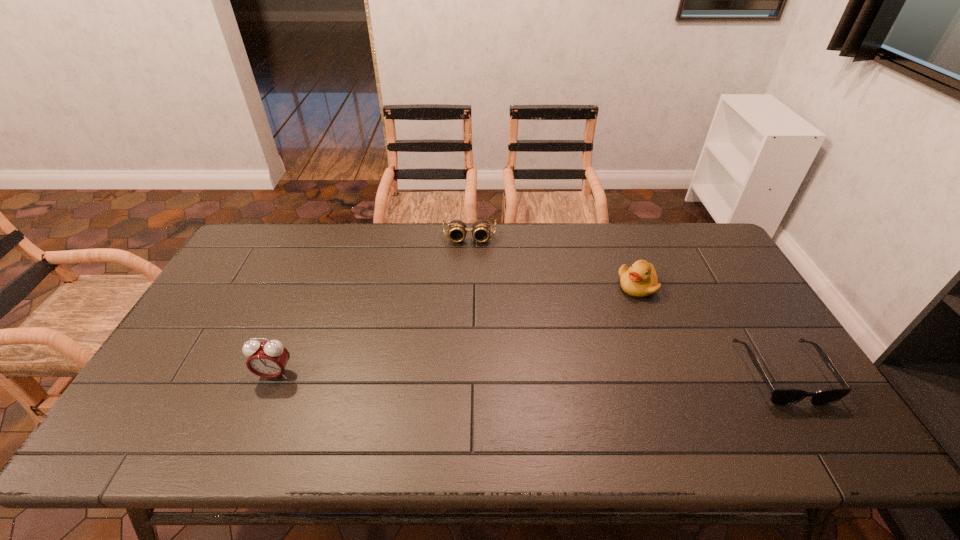
Image resolution: width=960 pixels, height=540 pixels. Find the location of `vacant position located through the lenses of the farthest object`. vacant position located through the lenses of the farthest object is located at coordinates (468, 272).

You are a GUI agent. You are given a task and a screenshot of the screen. Output one action in this format:
    pyautogui.click(x=<x>, y=<y>)
    Task: Click on the vacant position located through the lenses of the farthest object
    This screenshot has height=540, width=960.
    Given the screenshot: What is the action you would take?
    pyautogui.click(x=468, y=260)

Where is `vacant space situated at the beak of the duckling`? vacant space situated at the beak of the duckling is located at coordinates (590, 322).

Locate an element on the screen. This screenshot has height=540, width=960. vacant space positioned 0.190m at the beak of the duckling is located at coordinates (586, 326).

This screenshot has height=540, width=960. Find the location of `vacant space positioned at the beak of the duckling`. vacant space positioned at the beak of the duckling is located at coordinates (610, 308).

At what (x,y) coordinates should I click in order to perform the action: click on object that is positioned at the far edge. Please return your answer as a coordinate pair (x, y). The width and height of the screenshot is (960, 540). Looking at the image, I should click on (457, 229).

In order to click on object that is at the near edge in this screenshot , I will do coord(779,396).

Find the location of `object that is at the right edge`. object that is at the right edge is located at coordinates (779, 396).

Image resolution: width=960 pixels, height=540 pixels. Find the location of `object that is at the near right corner`. object that is at the near right corner is located at coordinates (779, 396).

The height and width of the screenshot is (540, 960). Find the location of `free region at the far edge of the desktop`. free region at the far edge of the desktop is located at coordinates (350, 233).